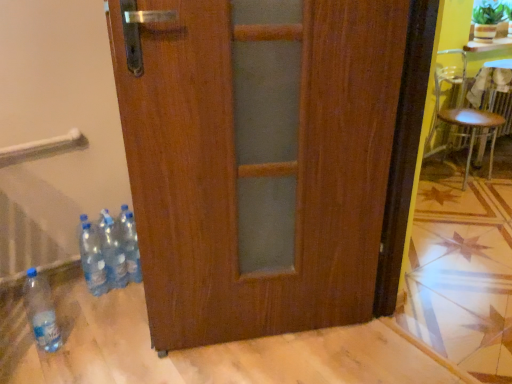
Locate an element on the screen. empty space that is in between transparent plastic bottle at lower left, positioned as the fourth bottle in right-to-left order, and transparent plastic bottles at lower left, the 2th bottle positioned from the left is located at coordinates (77, 315).